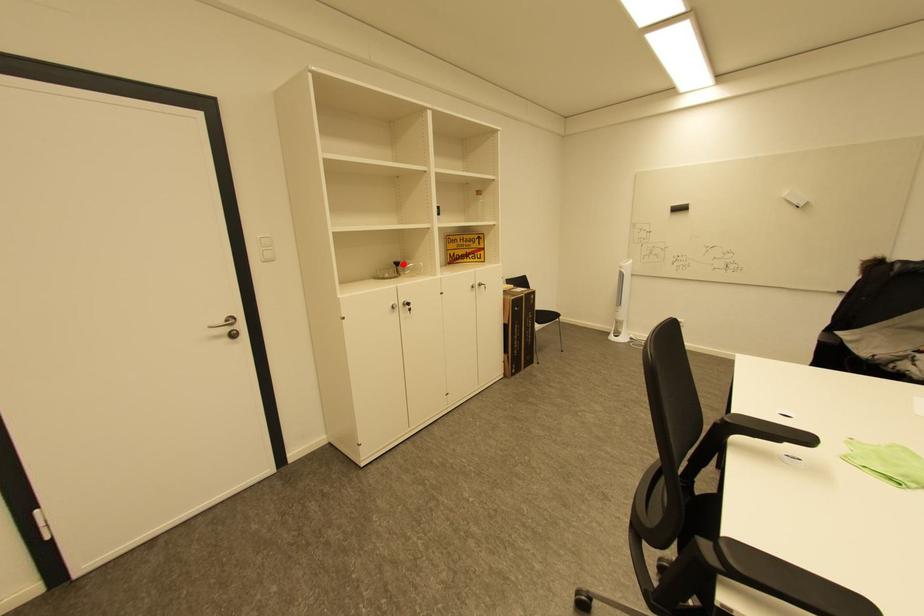
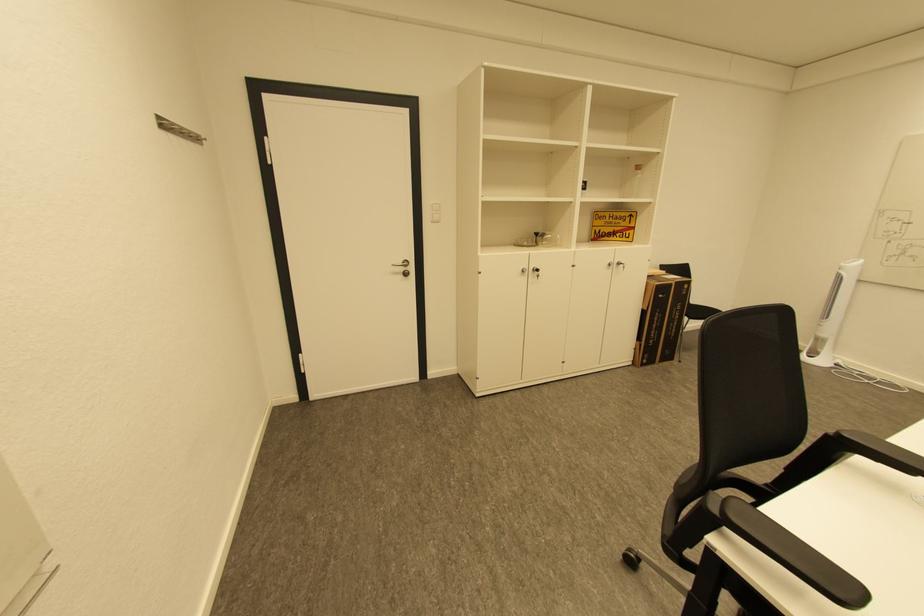
In the second image, find the point that corresponds to the highlighted location in the first image.

(543, 235)